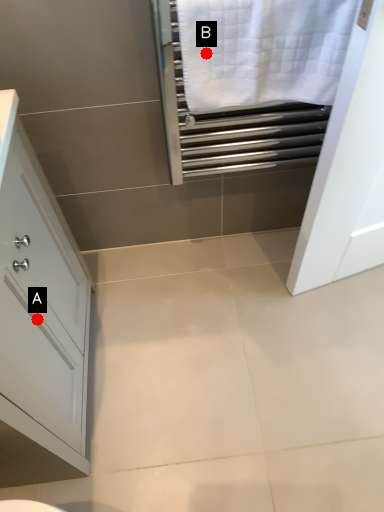
Question: Two points are circled on the image, labeled by A and B beside each circle. Which point is closer to the camera?

Choices:
 (A) A is closer
 (B) B is closer

Answer: (B)